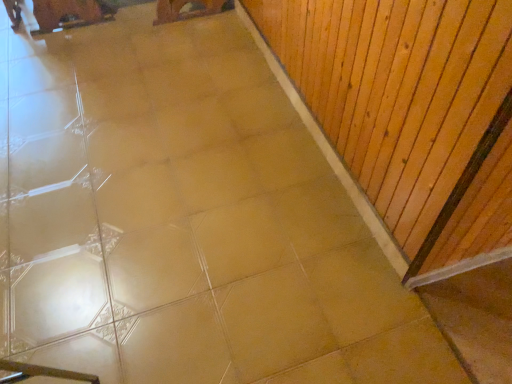
Locate an element on the screen. The width and height of the screenshot is (512, 384). vacant area that lies in front of natural wood plywood at upper right is located at coordinates click(x=250, y=224).